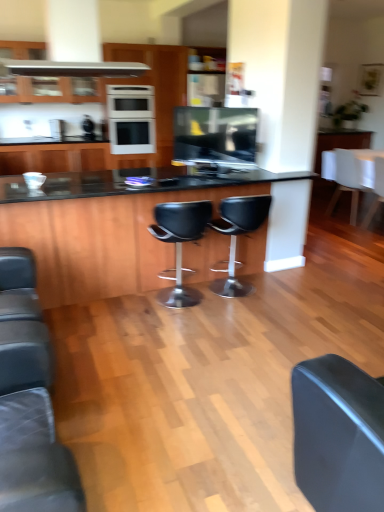
Question: Is white fabric chair at right, arranged as the 3th chair when viewed from the front, oriented away from black leather stool at center, marked as the second chair in a left-to-right arrangement?

Choices:
 (A) yes
 (B) no

Answer: (A)

Question: Considering the relative sizes of white fabric chair at right, which is the 4th chair from left to right, and black leather stool at center, marked as the second chair in a left-to-right arrangement, in the image provided, is white fabric chair at right, which is the 4th chair from left to right, shorter than black leather stool at center, marked as the second chair in a left-to-right arrangement,?

Choices:
 (A) yes
 (B) no

Answer: (B)

Question: From the image's perspective, is white fabric chair at right, which ranks as the 1th chair in right-to-left order, beneath black leather stool at center, the second chair in the front-to-back sequence?

Choices:
 (A) no
 (B) yes

Answer: (A)

Question: Can you confirm if white fabric chair at right, arranged as the 3th chair when viewed from the front, is positioned to the right of black leather stool at center, marked as the second chair in a left-to-right arrangement?

Choices:
 (A) yes
 (B) no

Answer: (A)

Question: Is there a large distance between white fabric chair at right, which is the 4th chair from left to right, and black leather stool at center, the 3th chair from the right?

Choices:
 (A) yes
 (B) no

Answer: (A)

Question: From a real-world perspective, is white fabric chair at right, arranged as the 3th chair when viewed from the front, below black leather stool at center, marked as the second chair in a left-to-right arrangement?

Choices:
 (A) no
 (B) yes

Answer: (A)

Question: Is white matte chair at right, arranged as the 3th chair when viewed from the left, not inside black glass table at center?

Choices:
 (A) no
 (B) yes

Answer: (B)

Question: Is white matte chair at right, arranged as the 3th chair when viewed from the left, shorter than black glass table at center?

Choices:
 (A) no
 (B) yes

Answer: (B)

Question: Is white matte chair at right, the first chair in the back-to-front sequence, bigger than black glass table at center?

Choices:
 (A) no
 (B) yes

Answer: (A)

Question: Can you confirm if white matte chair at right, the 4th chair positioned from the front, is smaller than black glass table at center?

Choices:
 (A) no
 (B) yes

Answer: (B)

Question: Does white matte chair at right, the first chair in the back-to-front sequence, come in front of black glass table at center?

Choices:
 (A) no
 (B) yes

Answer: (A)

Question: Does white matte chair at right, arranged as the 3th chair when viewed from the left, appear on the left side of black glass table at center?

Choices:
 (A) no
 (B) yes

Answer: (A)

Question: Is white matte counter top at right behind white glossy oven at upper center?

Choices:
 (A) no
 (B) yes

Answer: (A)